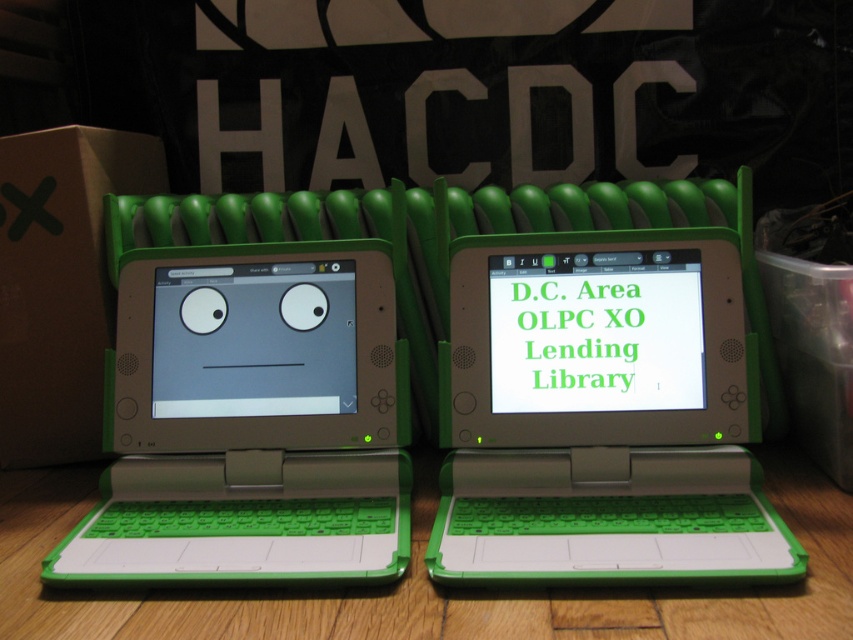
Who is positioned more to the right, green plastic laptops at center or green matte screen at center?

From the viewer's perspective, green matte screen at center appears more on the right side.

In order to click on green plastic laptops at center in this screenshot , I will do `click(425, 580)`.

Between point (28, 484) and point (523, 257), which one is positioned in front?

Point (523, 257) is in front.

The width and height of the screenshot is (853, 640). In order to click on green plastic laptops at center in this screenshot , I will do `click(425, 580)`.

Find the location of a particular element. white plastic laptop at center is located at coordinates click(x=602, y=413).

Does white plastic laptop at center appear over green plastic laptops at center?

Indeed, white plastic laptop at center is positioned over green plastic laptops at center.

Is white plastic laptop at center thinner than green plastic laptops at center?

Yes, white plastic laptop at center is thinner than green plastic laptops at center.

What do you see at coordinates (602, 413) in the screenshot?
I see `white plastic laptop at center` at bounding box center [602, 413].

I want to click on white plastic laptop at center, so click(x=602, y=413).